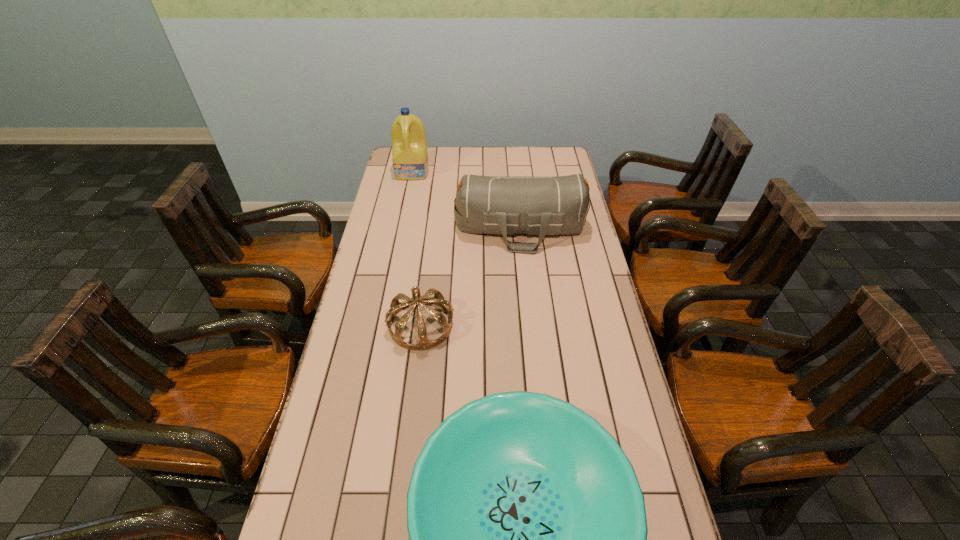
The width and height of the screenshot is (960, 540). I want to click on the farthest object, so click(409, 146).

You are a GUI agent. You are given a task and a screenshot of the screen. Output one action in this format:
    pyautogui.click(x=<x>, y=<y>)
    Task: Click on the detergent
    The image size is (960, 540).
    Given the screenshot: What is the action you would take?
    pyautogui.click(x=409, y=146)

Locate an element on the screen. the second farthest object is located at coordinates (559, 205).

I want to click on the third shortest object, so click(559, 205).

Where is `the second nearest object`? This screenshot has height=540, width=960. the second nearest object is located at coordinates (438, 299).

Identify the location of the second shortest object. (438, 299).

The image size is (960, 540). I want to click on vacant position located on the label of the farthest object, so click(408, 196).

Image resolution: width=960 pixels, height=540 pixels. In order to click on vacant space located 0.110m on the left of the duffel bag in this screenshot , I will do `click(426, 228)`.

The width and height of the screenshot is (960, 540). In order to click on free space located 0.150m on the front of the second shortest object in this screenshot , I will do `click(412, 397)`.

Where is `object that is at the far edge`? object that is at the far edge is located at coordinates (409, 146).